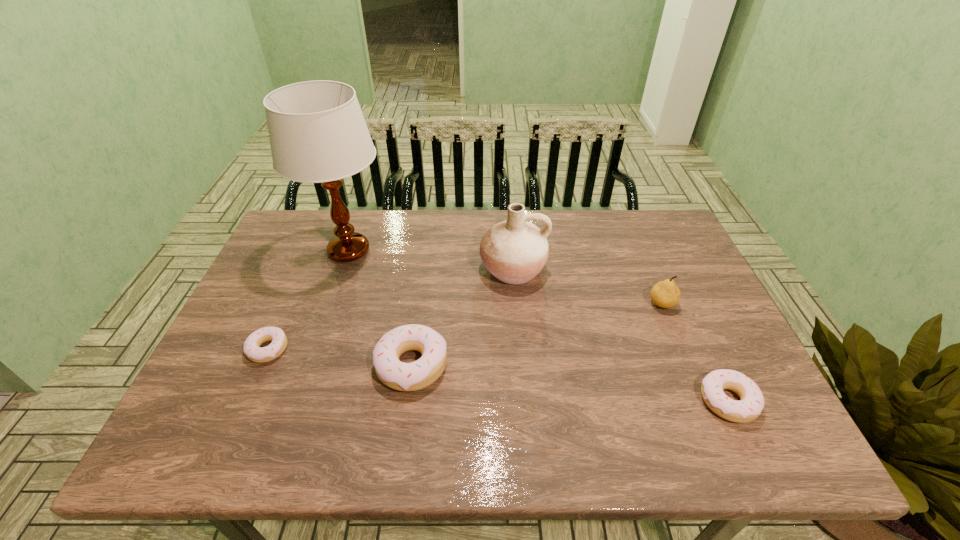
If equal spacing is desired by inserting an extra doughnut among them, please point out a free spot for this new doughnut. Please provide its 2D coordinates. Your answer should be formatted as a tuple, i.e. [(x, y)], where the tuple contains the x and y coordinates of a point satisfying the conditions above.

[(564, 382)]